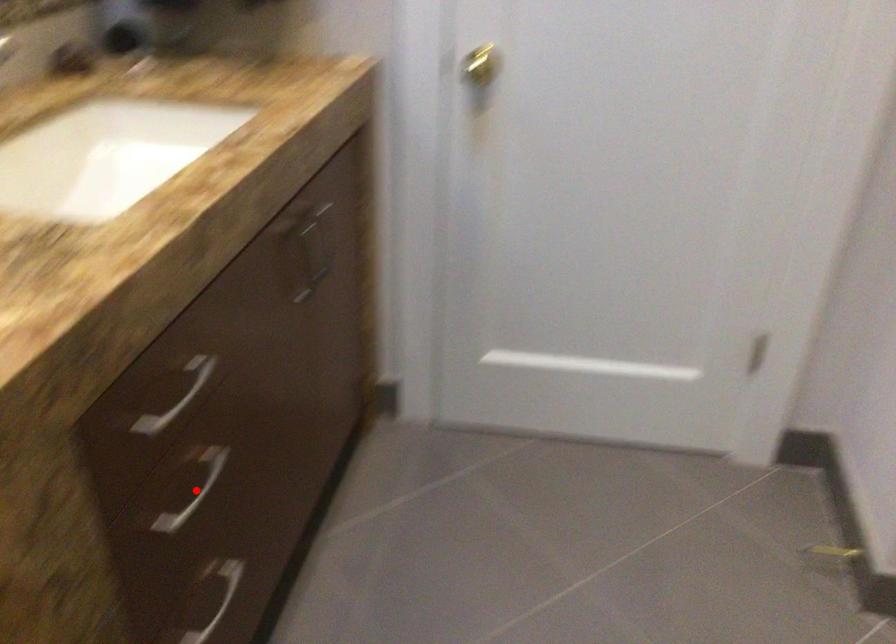
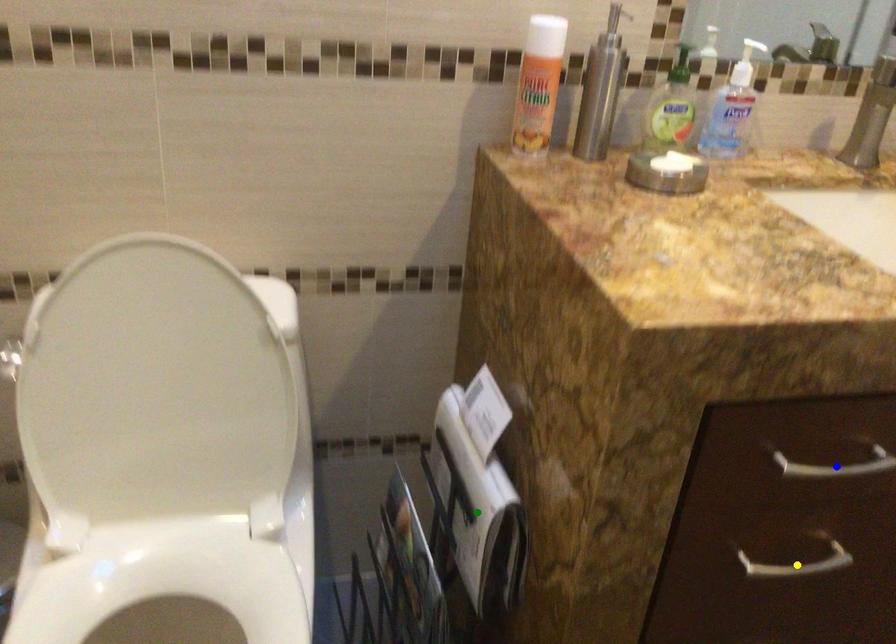
Question: I am providing you with two images of the same scene from different viewpoints. A red point is marked on the first image. You are given multiple points on the second image. Which point in image 2 represents the same 3d spot as the red point in image 1?

Choices:
 (A) green point
 (B) yellow point
 (C) blue point

Answer: (B)